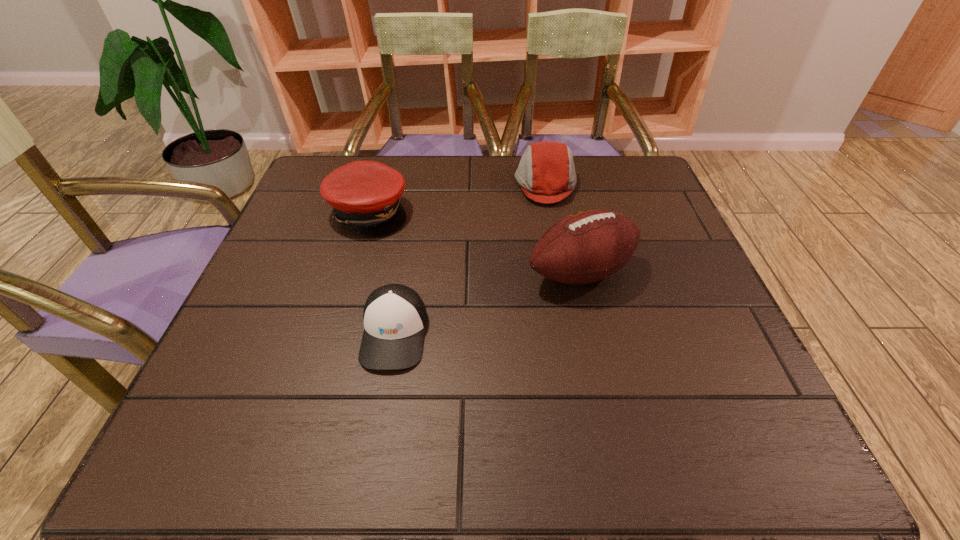
The image size is (960, 540). I want to click on object situated at the far left corner, so click(x=365, y=195).

In the image, there is a desktop. Identify the location of vacant space at the far edge. (506, 190).

The width and height of the screenshot is (960, 540). I want to click on free spot at the near edge of the desktop, so click(607, 456).

Where is `vacant space at the left edge of the desktop`? This screenshot has height=540, width=960. vacant space at the left edge of the desktop is located at coordinates (275, 391).

This screenshot has width=960, height=540. I want to click on free space at the right edge of the desktop, so point(749,379).

Identify the location of vacant area at the far left corner of the desktop. (310, 181).

In the image, there is a desktop. Where is `free space at the far right corner`? The height and width of the screenshot is (540, 960). free space at the far right corner is located at coordinates (594, 165).

The height and width of the screenshot is (540, 960). I want to click on empty location between the nearest cap and the rightmost cap, so click(x=470, y=259).

You are a GUI agent. You are given a task and a screenshot of the screen. Output one action in this format:
    pyautogui.click(x=<x>, y=<y>)
    Task: Click on the vacant area that lies between the nearest cap and the tallest object
    
    Given the screenshot: What is the action you would take?
    click(488, 303)

The width and height of the screenshot is (960, 540). Find the location of `free point between the tallest object and the nearest cap`. free point between the tallest object and the nearest cap is located at coordinates (488, 303).